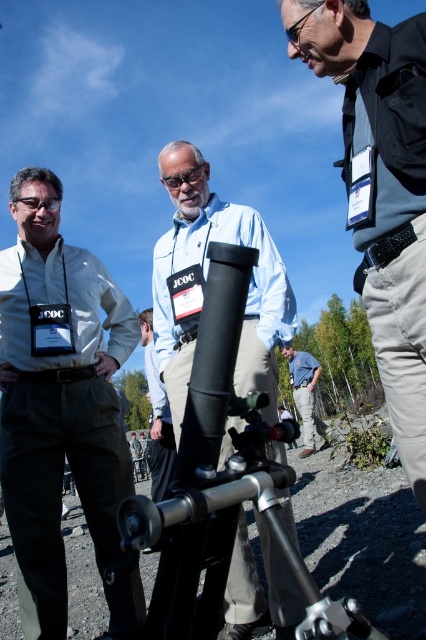
Question: Among these points, which one is nearest to the camera?

Choices:
 (A) click(198, 209)
 (B) click(29, 445)
 (C) click(187, 177)

Answer: (B)

Question: Is matte black telescope at center behind blue denim shirt at lower center?

Choices:
 (A) yes
 (B) no

Answer: (B)

Question: Can you confirm if matte black telescope at center is positioned to the left of matte black goggles at center?

Choices:
 (A) no
 (B) yes

Answer: (A)

Question: Is black matte shirt at upper right smaller than matte black goggles at center?

Choices:
 (A) yes
 (B) no

Answer: (B)

Question: Which object is the farthest from the matte black goggles at center?

Choices:
 (A) matte khaki pants at left
 (B) black matte shirt at upper right
 (C) blue denim shirt at lower center
 (D) matte black telescope at center

Answer: (C)

Question: Estimate the real-world distances between objects in this image. Which object is closer to the matte black goggles at center?

Choices:
 (A) matte khaki pants at left
 (B) black matte shirt at upper right
 (C) blue denim shirt at lower center

Answer: (B)